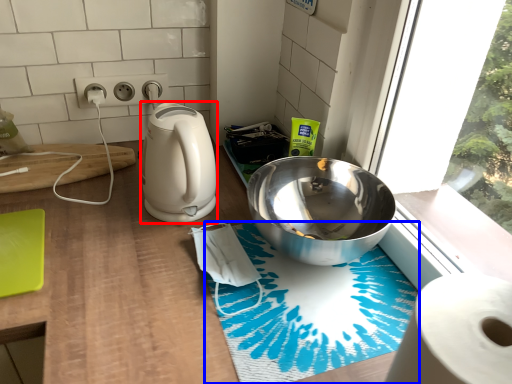
Question: Which object appears closest to the camera in this image, kitchen appliance (highlighted by a red box) or bath mat (highlighted by a blue box)?

Choices:
 (A) kitchen appliance
 (B) bath mat

Answer: (B)